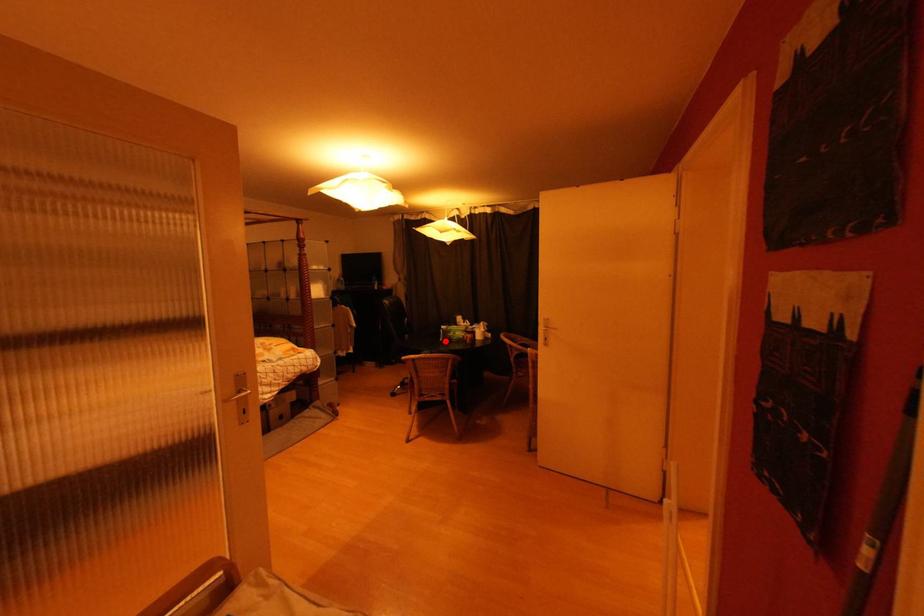
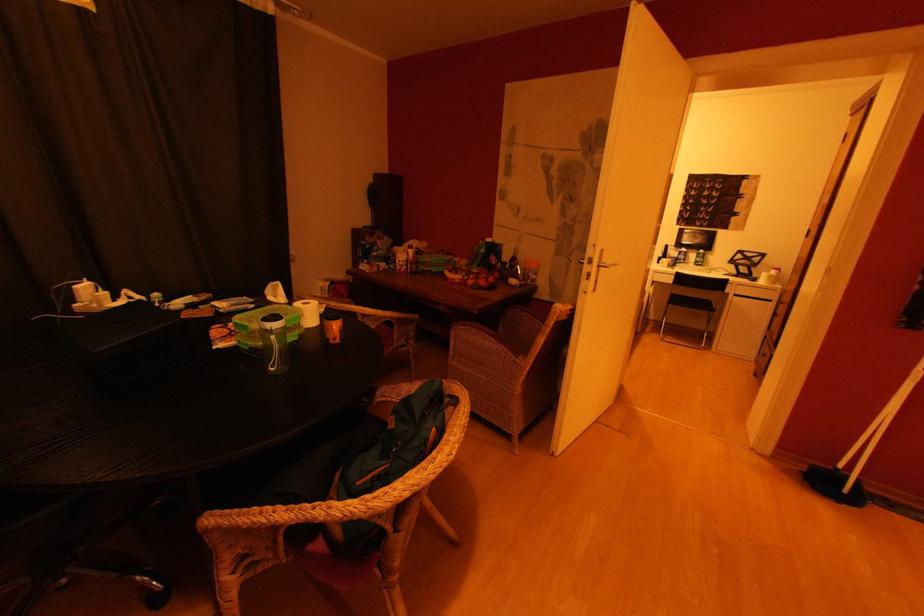
Where in the second image is the point corresponding to the highlighted location from the first image?

(276, 371)